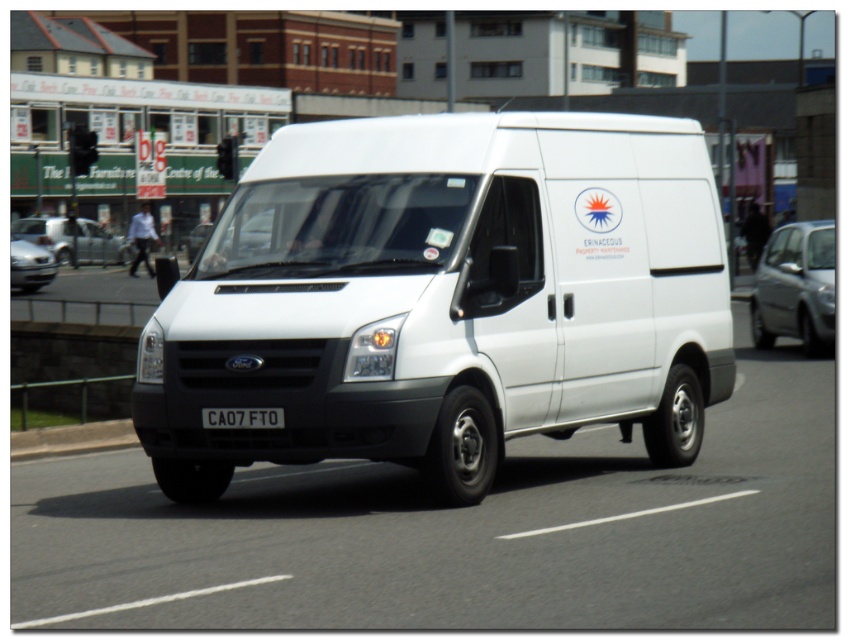
Question: Among these objects, which one is nearest to the camera?

Choices:
 (A) matte black car at left
 (B) silver metallic hatchback at right

Answer: (B)

Question: Which object is farther from the camera taking this photo?

Choices:
 (A) silver metallic hatchback at right
 (B) gray concrete curb at lower left
 (C) white matte van at center
 (D) matte black car at left

Answer: (D)

Question: Is matte black car at left below black plastic license plate at center?

Choices:
 (A) no
 (B) yes

Answer: (A)

Question: Which of the following is the farthest from the observer?

Choices:
 (A) pyautogui.click(x=106, y=426)
 (B) pyautogui.click(x=25, y=284)
 (C) pyautogui.click(x=454, y=118)

Answer: (B)

Question: Can you confirm if silver metallic hatchback at right is positioned above matte black car at left?

Choices:
 (A) yes
 (B) no

Answer: (B)

Question: Can you confirm if silver metallic sedan at center is wider than matte black car at left?

Choices:
 (A) yes
 (B) no

Answer: (B)